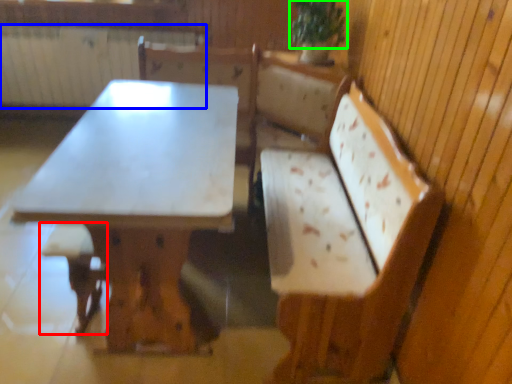
Question: Based on their relative distances, which object is farther from step stool (highlighted by a red box)? Choose from radiator (highlighted by a blue box) and plant (highlighted by a green box).

Choices:
 (A) radiator
 (B) plant

Answer: (A)